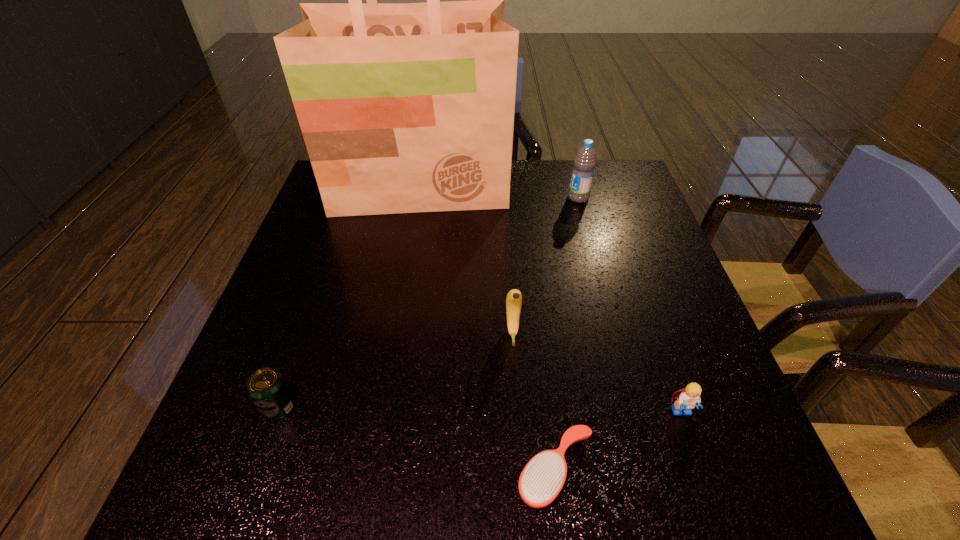
What are the coordinates of `object that is the fourth closest one to the rightmost object` in the screenshot? It's located at (584, 162).

Where is `vacant area that satisfies the following two spatial constraints: 1. on the back side of the nearest object; 2. on the left side of the water bottle`? vacant area that satisfies the following two spatial constraints: 1. on the back side of the nearest object; 2. on the left side of the water bottle is located at coordinates (523, 198).

Identify the location of vacant position in the image that satisfies the following two spatial constraints: 1. from the stem of the shortest object; 2. on the right side of the banana. The height and width of the screenshot is (540, 960). coord(521,470).